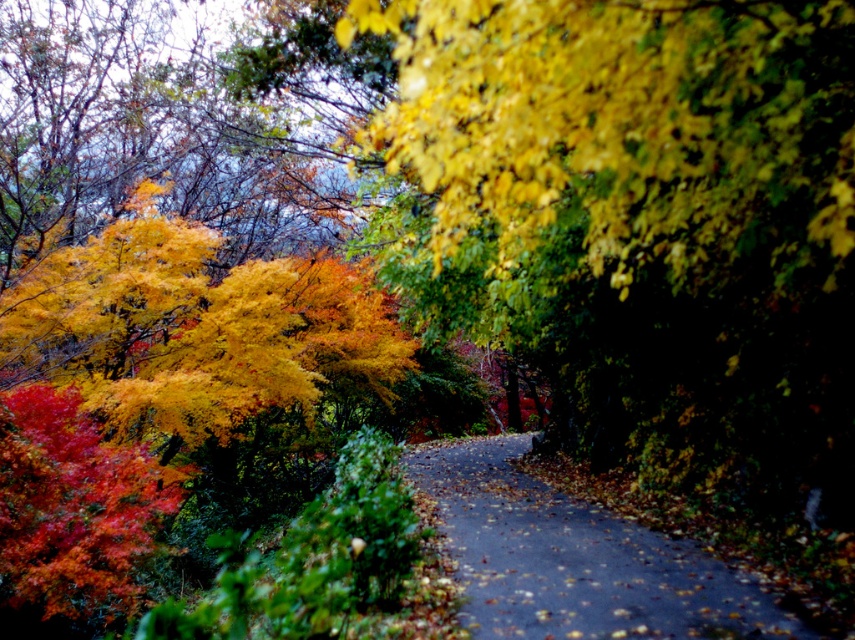
Between vibrant yellow leaves at left and dark asphalt road at center, which one is positioned lower?

dark asphalt road at center is lower down.

Between point (86, 324) and point (510, 467), which one is positioned behind?

The point (510, 467) is behind.

You are a GUI agent. You are given a task and a screenshot of the screen. Output one action in this format:
    pyautogui.click(x=<x>, y=<y>)
    Task: Click on the vibrant yellow leaves at left
    
    Given the screenshot: What is the action you would take?
    (x=155, y=387)